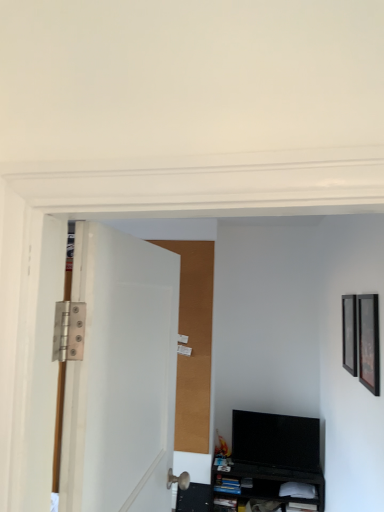
Question: Is white matte door at left outside of black glossy picture frame at right, the 2th picture frame from the right?

Choices:
 (A) yes
 (B) no

Answer: (A)

Question: Is white matte door at left positioned far away from black glossy picture frame at right, the second picture frame when ordered from back to front?

Choices:
 (A) no
 (B) yes

Answer: (B)

Question: From a real-world perspective, is white matte door at left physically above black glossy picture frame at right, placed as the first picture frame when sorted from left to right?

Choices:
 (A) no
 (B) yes

Answer: (A)

Question: Is white matte door at left with black glossy picture frame at right, the 1th picture frame positioned from the front?

Choices:
 (A) no
 (B) yes

Answer: (A)

Question: Is white matte door at left facing away from black glossy picture frame at right, the 1th picture frame positioned from the front?

Choices:
 (A) no
 (B) yes

Answer: (A)

Question: Is point (370, 345) closer or farther from the camera than point (253, 484)?

Choices:
 (A) farther
 (B) closer

Answer: (B)

Question: From the image's perspective, is black glossy picture frame at right, placed as the first picture frame when sorted from left to right, above or below black matte cabinet at lower center?

Choices:
 (A) above
 (B) below

Answer: (A)

Question: In the image, is black glossy picture frame at right, the 1th picture frame positioned from the front, positioned in front of or behind black matte cabinet at lower center?

Choices:
 (A) front
 (B) behind

Answer: (A)

Question: From a real-world perspective, is black glossy picture frame at right, the 1th picture frame positioned from the front, physically located above or below black matte cabinet at lower center?

Choices:
 (A) below
 (B) above

Answer: (B)

Question: Based on their positions, is black glossy tv at lower right located to the left or right of black glossy picture frame at right, the 2th picture frame from the right?

Choices:
 (A) left
 (B) right

Answer: (A)

Question: Do you think black glossy tv at lower right is within black glossy picture frame at right, the 1th picture frame positioned from the front, or outside of it?

Choices:
 (A) outside
 (B) inside

Answer: (A)

Question: Is black glossy tv at lower right in front of or behind black glossy picture frame at right, the 1th picture frame positioned from the front, in the image?

Choices:
 (A) behind
 (B) front

Answer: (A)

Question: Does point (284, 457) appear closer or farther from the camera than point (360, 366)?

Choices:
 (A) farther
 (B) closer

Answer: (A)

Question: From a real-world perspective, is white matte door at left physically located above or below black matte cabinet at lower center?

Choices:
 (A) above
 (B) below

Answer: (A)

Question: Considering the relative positions of white matte door at left and black matte cabinet at lower center in the image provided, is white matte door at left to the left or to the right of black matte cabinet at lower center?

Choices:
 (A) right
 (B) left

Answer: (B)